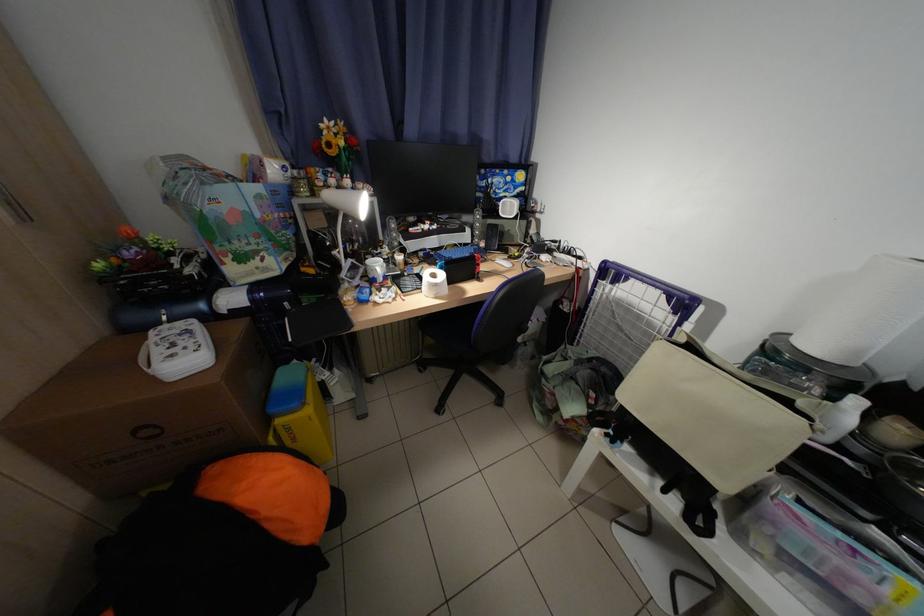
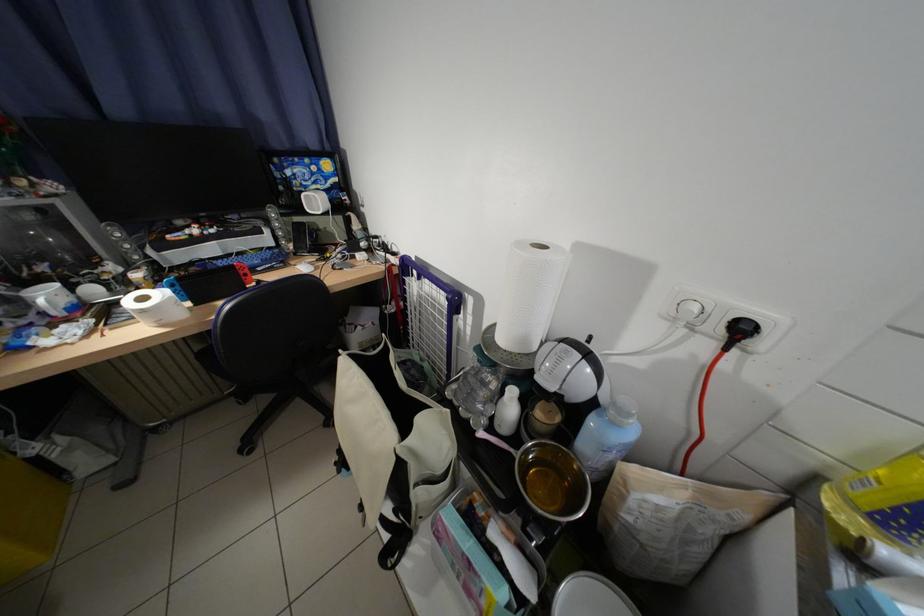
Question: In a continuous first-person perspective shot, in which direction is the camera moving?

Choices:
 (A) Left
 (B) Right
 (C) Forward
 (D) Backward

Answer: (B)